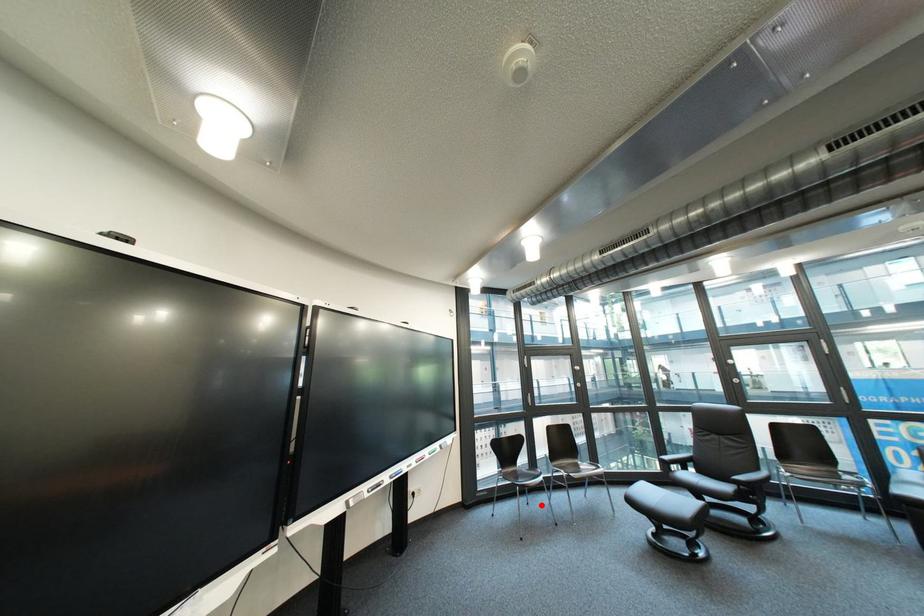
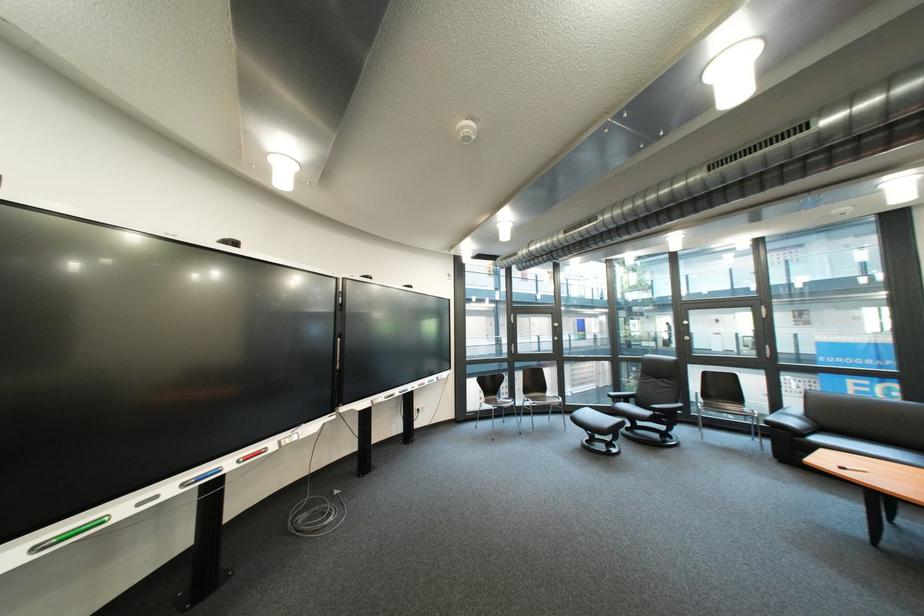
Where in the second image is the point corresponding to the highlighted location from the first image?

(517, 424)